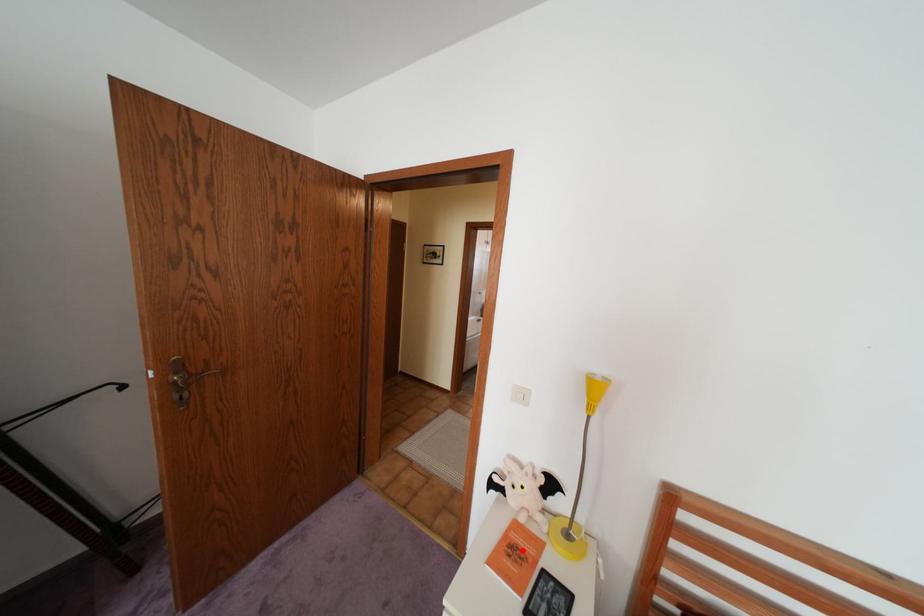
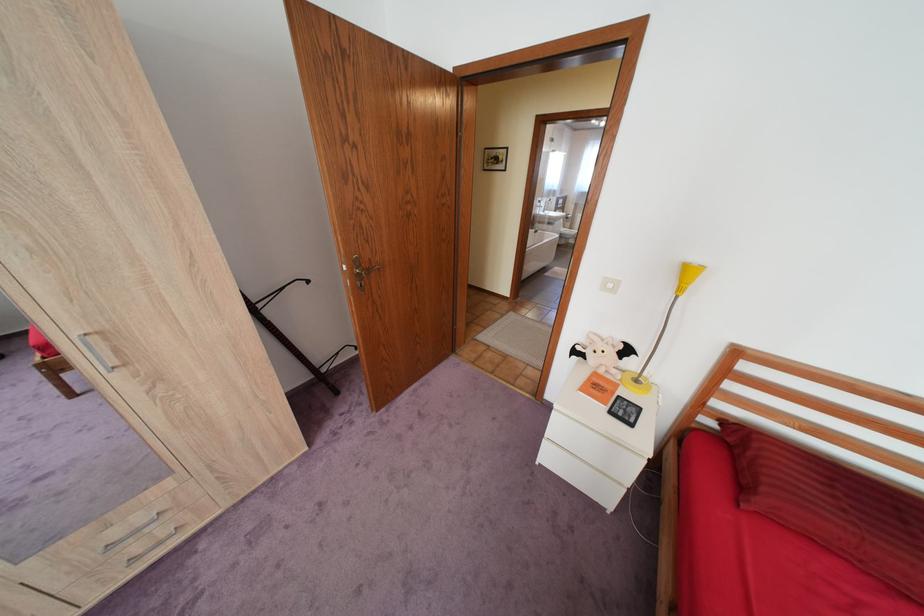
The point at the highlighted location is marked in the first image. Where is the corresponding point in the second image?

(606, 386)